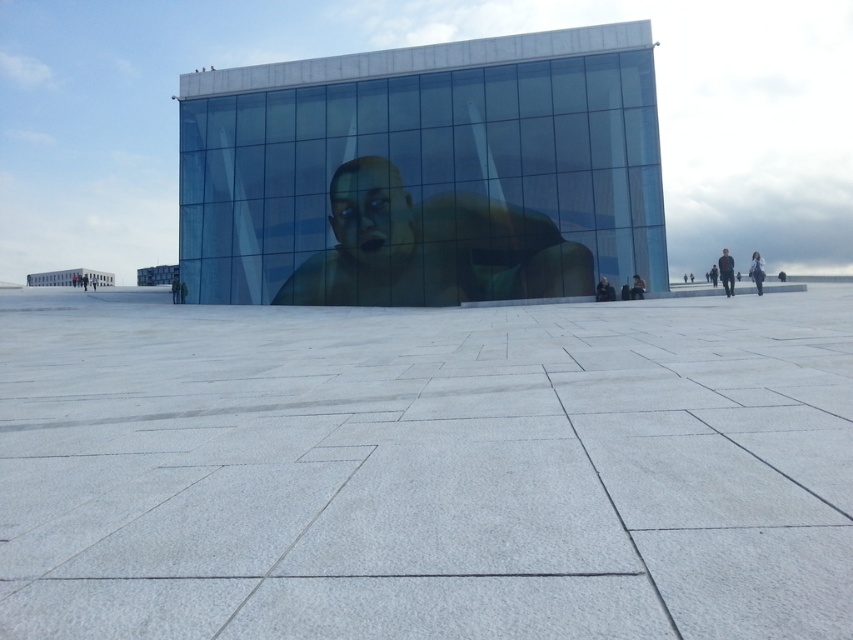
Question: Is the position of dark gray fabric jacket at center more distant than that of matte black person at center?

Choices:
 (A) yes
 (B) no

Answer: (A)

Question: Which is farther from the dark gray fabric jacket at center?

Choices:
 (A) green matte mask at center
 (B) white polished stone plaza at center

Answer: (B)

Question: Which object is farther from the camera taking this photo?

Choices:
 (A) white polished stone plaza at center
 (B) matte black person at center
 (C) smooth green face at center

Answer: (C)

Question: Based on their relative distances, which object is nearer to the smooth green face at center?

Choices:
 (A) dark gray fabric jacket at center
 (B) matte black person at center
 (C) green matte mask at center

Answer: (C)

Question: Is white polished stone plaza at center to the right of dark gray fabric jacket at center from the viewer's perspective?

Choices:
 (A) yes
 (B) no

Answer: (B)

Question: Considering the relative positions of green matte mask at center and smooth green face at center in the image provided, where is green matte mask at center located with respect to smooth green face at center?

Choices:
 (A) right
 (B) left

Answer: (A)